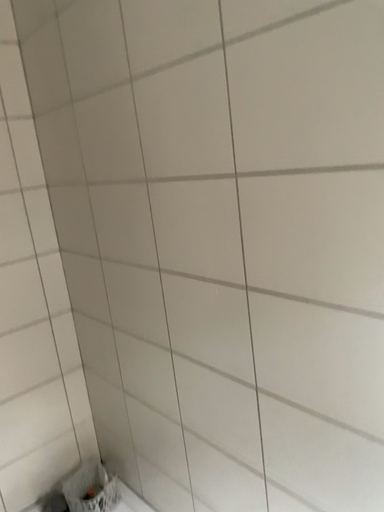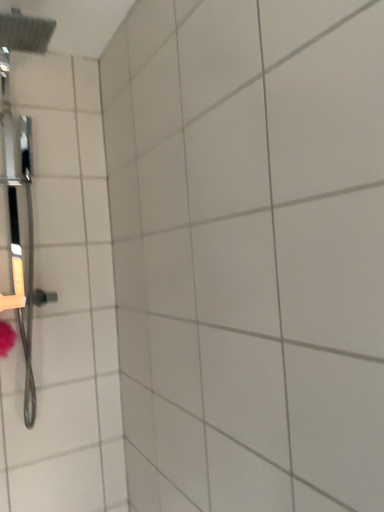
Question: Which way did the camera rotate in the video?

Choices:
 (A) rotated right
 (B) rotated left

Answer: (B)